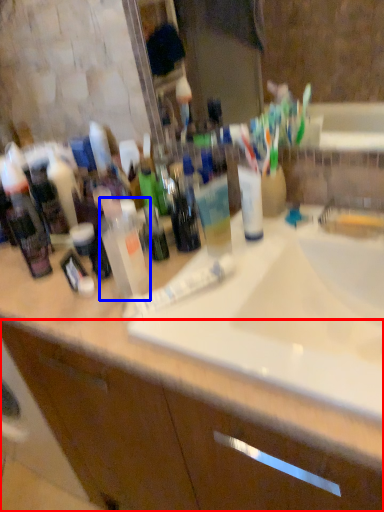
Question: Among these objects, which one is farthest to the camera, bathroom cabinet (highlighted by a red box) or cleaning product (highlighted by a blue box)?

Choices:
 (A) bathroom cabinet
 (B) cleaning product

Answer: (B)